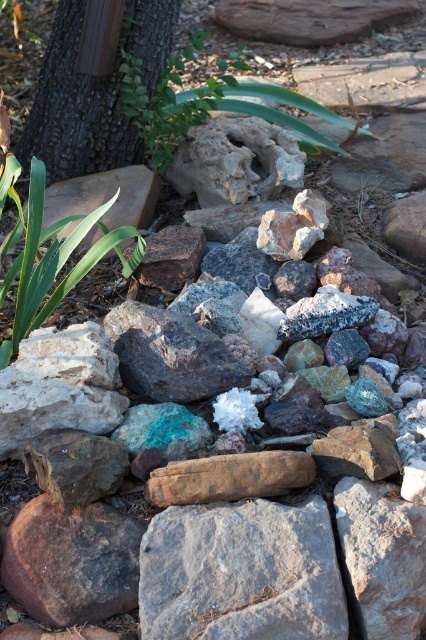
You are standing in the outdoor scene and want to place a small statue on the tallest object available. Which object should you choose between the gray rough rock at center and the green leafy plant at upper center?

The green leafy plant at upper center is taller than the gray rough rock at center, so you should place the small statue on the green leafy plant at upper center.